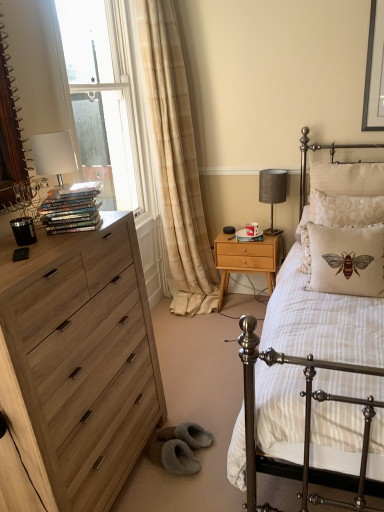
At what (x,y) coordinates should I click in order to perform the action: click on white striped fabric at center. Please return your answer as a coordinate pair (x, y). The width and height of the screenshot is (384, 512). Looking at the image, I should click on (305, 426).

What are the coordinates of `beige fabric curtain at left` in the screenshot? It's located at (176, 160).

What is the approximate width of textured gray fabric lampshade at right?

8.28 inches.

Where is `beige damask pillow with bee design at center, the first pillow in the back-to-front sequence`? The image size is (384, 512). beige damask pillow with bee design at center, the first pillow in the back-to-front sequence is located at coordinates (348, 210).

This screenshot has height=512, width=384. What are the coordinates of `white striped fabric at center` in the screenshot? It's located at (305, 426).

How far apart are light wood chest of drawers at left and white glass window at upper left?

A distance of 1.80 meters exists between light wood chest of drawers at left and white glass window at upper left.

What's the angular difference between light wood chest of drawers at left and white glass window at upper left's facing directions?

The angle between the facing direction of light wood chest of drawers at left and the facing direction of white glass window at upper left is 2.72 degrees.

Are light wood chest of drawers at left and white glass window at upper left making contact?

No.

Looking at this image, is light wood chest of drawers at left situated inside white glass window at upper left or outside?

light wood chest of drawers at left exists outside the volume of white glass window at upper left.

Consider the image. Which object is wider, shiny metallic books at left or light wood chest of drawers at left?

light wood chest of drawers at left is wider.

Relative to light wood chest of drawers at left, is shiny metallic books at left in front or behind?

Clearly, shiny metallic books at left is behind light wood chest of drawers at left.

From a real-world perspective, who is located higher, shiny metallic books at left or light wood chest of drawers at left?

shiny metallic books at left.

Is shiny metallic books at left oriented towards light wood chest of drawers at left?

No.

Is shiny metallic books at left at the right side of white glass window at upper left?

Indeed, shiny metallic books at left is positioned on the right side of white glass window at upper left.

Considering the positions of point (82, 223) and point (71, 64), is point (82, 223) closer or farther from the camera than point (71, 64)?

Point (82, 223) appears to be closer to the viewer than point (71, 64).

From the image's perspective, which one is positioned lower, shiny metallic books at left or white glass window at upper left?

shiny metallic books at left appears lower in the image.

Locate an element on the screen. Image resolution: width=384 pixels, height=512 pixels. window behind the shiny metallic books at left is located at coordinates (108, 96).

From a real-world perspective, is textured gray fabric lampshade at right on top of white striped fabric at center?

Yes.

Is textured gray fabric lampshade at right wider or thinner than white striped fabric at center?

textured gray fabric lampshade at right is thinner than white striped fabric at center.

Looking at the image, does textured gray fabric lampshade at right seem bigger or smaller compared to white striped fabric at center?

textured gray fabric lampshade at right is smaller than white striped fabric at center.

The image size is (384, 512). I want to click on table lamp located above the white striped fabric at center (from a real-world perspective), so click(272, 192).

Which is more to the left, light wood chest of drawers at left or textured gray fabric lampshade at right?

light wood chest of drawers at left.

What's the angular difference between light wood chest of drawers at left and textured gray fabric lampshade at right's facing directions?

The angular difference between light wood chest of drawers at left and textured gray fabric lampshade at right is 87.9 degrees.

Considering the relative positions of light wood chest of drawers at left and textured gray fabric lampshade at right in the image provided, is light wood chest of drawers at left in front of textured gray fabric lampshade at right?

That is True.

Does light wood chest of drawers at left have a greater width compared to textured gray fabric lampshade at right?

Yes, light wood chest of drawers at left is wider than textured gray fabric lampshade at right.

Is point (63, 47) closer or farther from the camera than point (242, 262)?

Point (63, 47) is closer to the camera than point (242, 262).

The height and width of the screenshot is (512, 384). Find the location of `window above the light wood/texture nightstand at center (from a real-world perspective)`. window above the light wood/texture nightstand at center (from a real-world perspective) is located at coordinates tap(108, 96).

From a real-world perspective, is white glass window at upper left below light wood/texture nightstand at center?

No.

What are the coordinates of `curtain located above the beige damask pillow with bee design at center, which ranks as the third pillow in front-to-back order (from the image's perspective)` in the screenshot? It's located at (176, 160).

Are beige fabric curtain at left and beige damask pillow with bee design at center, the first pillow in the back-to-front sequence, beside each other?

No, beige fabric curtain at left is not with beige damask pillow with bee design at center, the first pillow in the back-to-front sequence.

Is beige fabric curtain at left bigger or smaller than beige damask pillow with bee design at center, the first pillow in the back-to-front sequence?

Clearly, beige fabric curtain at left is larger in size than beige damask pillow with bee design at center, the first pillow in the back-to-front sequence.

Does beige fabric curtain at left lie behind beige damask pillow with bee design at center, which ranks as the third pillow in front-to-back order?

No, beige fabric curtain at left is in front of beige damask pillow with bee design at center, which ranks as the third pillow in front-to-back order.

I want to click on chest of drawers below the white glass window at upper left (from a real-world perspective), so click(x=79, y=362).

This screenshot has height=512, width=384. I want to click on book above the light wood chest of drawers at left (from the image's perspective), so pos(71,209).

Which object lies further to the anchor point beige damask pillow with bee design at center, the first pillow in the back-to-front sequence, shiny metallic books at left or white glass window at upper left?

white glass window at upper left lies further to beige damask pillow with bee design at center, the first pillow in the back-to-front sequence, than the other object.

When comparing their distances from light wood chest of drawers at left, does light wood/texture nightstand at center or beige embroidered pillow at right, which is counted as the 3th pillow, starting from the back, seem further?

light wood/texture nightstand at center.

Based on their spatial positions, is white glass window at upper left or light wood/texture nightstand at center further from beige fabric curtain at left?

light wood/texture nightstand at center is further to beige fabric curtain at left.

Considering their positions, is light wood chest of drawers at left positioned further to beige damask pillow with bee design at center, the first pillow in the back-to-front sequence, than white striped fabric at center?

light wood chest of drawers at left is further to beige damask pillow with bee design at center, the first pillow in the back-to-front sequence.

Consider the image. Which object lies further to the anchor point light wood chest of drawers at left, shiny metallic books at left or light wood/texture nightstand at center?

The object further to light wood chest of drawers at left is light wood/texture nightstand at center.

From the image, which object appears to be nearer to light wood chest of drawers at left, white glass window at upper left or beige damask pillow at right, marked as the second pillow in a back-to-front arrangement?

Based on the image, beige damask pillow at right, marked as the second pillow in a back-to-front arrangement, appears to be nearer to light wood chest of drawers at left.

Considering their positions, is beige embroidered pillow at right, the 1th pillow in the front-to-back sequence, positioned closer to white striped fabric at center than light wood/texture nightstand at center?

beige embroidered pillow at right, the 1th pillow in the front-to-back sequence.

Considering their positions, is light wood/texture nightstand at center positioned closer to light wood chest of drawers at left than textured gray fabric lampshade at right?

light wood/texture nightstand at center lies closer to light wood chest of drawers at left than the other object.

Identify the location of curtain between white glass window at upper left and beige embroidered pillow at right, the 1th pillow in the front-to-back sequence, from left to right. (176, 160).

Find the location of a particular element. Image resolution: width=384 pixels, height=512 pixels. nightstand between shiny metallic books at left and beige damask pillow with bee design at center, the first pillow in the back-to-front sequence, from left to right is located at coordinates (246, 260).

Find the location of a particular element. The height and width of the screenshot is (512, 384). the chest of drawers positioned between white striped fabric at center and textured gray fabric lampshade at right from near to far is located at coordinates (79, 362).

Locate an element on the screen. The height and width of the screenshot is (512, 384). curtain situated between shiny metallic books at left and beige damask pillow with bee design at center, the first pillow in the back-to-front sequence, from left to right is located at coordinates (176, 160).